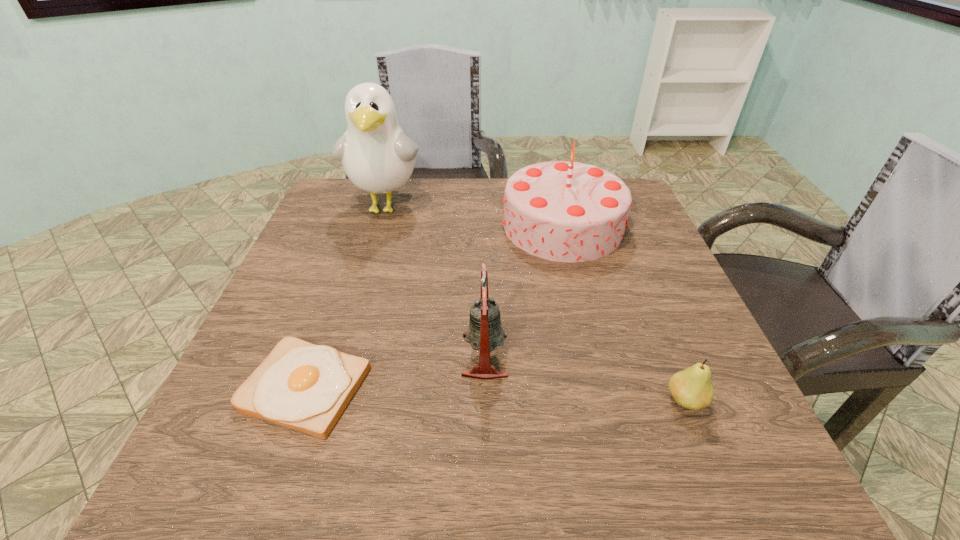
I want to click on the tallest object, so click(377, 156).

You are a GUI agent. You are given a task and a screenshot of the screen. Output one action in this format:
    pyautogui.click(x=<x>, y=<y>)
    Task: Click on the birthday cake
    The image size is (960, 540).
    Given the screenshot: What is the action you would take?
    pyautogui.click(x=566, y=211)

Image resolution: width=960 pixels, height=540 pixels. What are the coordinates of `the third shortest object` in the screenshot? It's located at (485, 332).

Identify the location of bell. Image resolution: width=960 pixels, height=540 pixels. pos(485,332).

Identify the location of pear. (691, 388).

Identify the location of toast. (302, 386).

Identify the location of blank space located on the beak of the tallest object. (362, 287).

Find the location of a particular element. Image resolution: width=960 pixels, height=540 pixels. vacant space located on the front of the birthday cake is located at coordinates (578, 288).

Where is `free space located on the right of the bell`? free space located on the right of the bell is located at coordinates (619, 355).

Where is `vacant space located 0.150m on the left of the pear`? vacant space located 0.150m on the left of the pear is located at coordinates (573, 401).